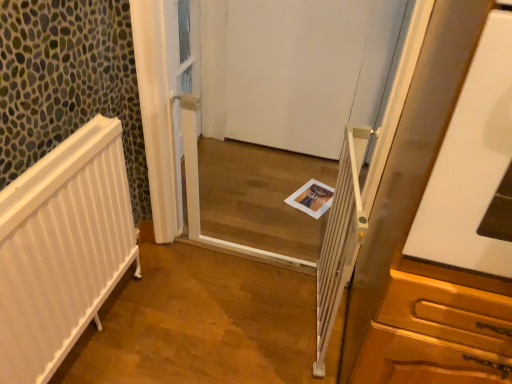
Find the location of a particular element. free space in front of white matte door at center is located at coordinates [272, 187].